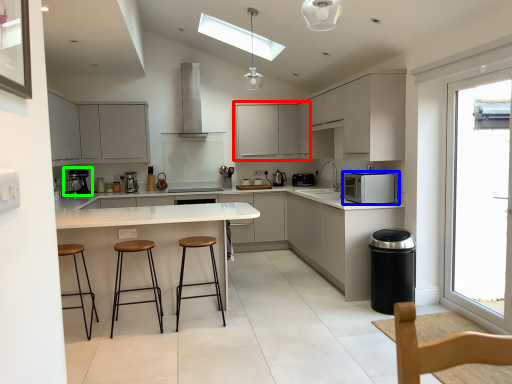
Question: Estimate the real-world distances between objects in this image. Which object is closer to cabinetry (highlighted by a red box), kitchen appliance (highlighted by a blue box) or coffee machine (highlighted by a green box)?

Choices:
 (A) kitchen appliance
 (B) coffee machine

Answer: (B)